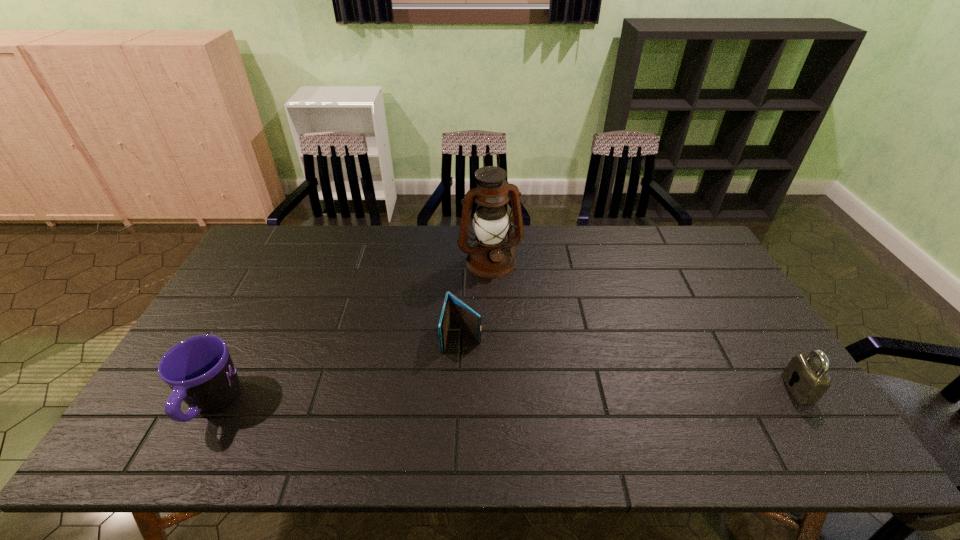
Locate an element on the screen. The width and height of the screenshot is (960, 540). vacant space on the desktop that is between the leftmost object and the padlock and is positioned on the side of the lantern, there is a wick adjustment knob is located at coordinates (547, 395).

Locate an element on the screen. The width and height of the screenshot is (960, 540). free space on the desktop that is between the mug and the padlock and is positioned on the exterior surface of the second farthest object is located at coordinates point(449,398).